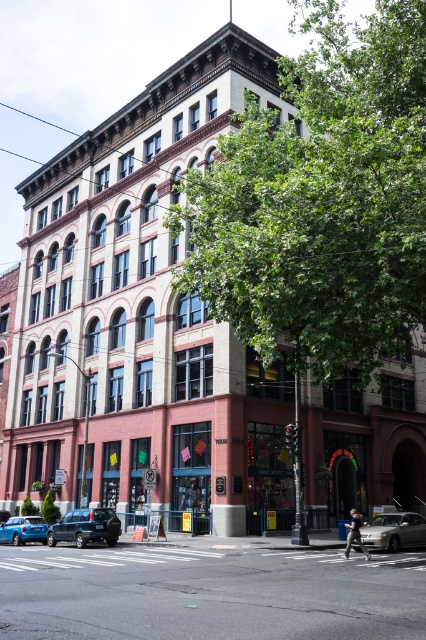
Which of these two, black asphalt at center or silver metallic sedan at lower right, stands shorter?

Standing shorter between the two is silver metallic sedan at lower right.

Where is `black asphalt at center`? black asphalt at center is located at coordinates (207, 593).

Find the location of `black asphalt at center`. black asphalt at center is located at coordinates (207, 593).

Is black matte suv at lower left smaller than silver metallic sedan at lower right?

Actually, black matte suv at lower left might be larger than silver metallic sedan at lower right.

Who is lower down, black matte suv at lower left or silver metallic sedan at lower right?

black matte suv at lower left

You are a GUI agent. You are given a task and a screenshot of the screen. Output one action in this format:
    pyautogui.click(x=<x>, y=<y>)
    Task: Click on the black matte suv at lower left
    This screenshot has height=640, width=426.
    Given the screenshot: What is the action you would take?
    pyautogui.click(x=86, y=525)

Between black matte suv at lower left and metallic blue sedan at lower left, which one has more height?

black matte suv at lower left is taller.

Is black matte suv at lower left wider than metallic blue sedan at lower left?

Indeed, black matte suv at lower left has a greater width compared to metallic blue sedan at lower left.

What do you see at coordinates (86, 525) in the screenshot? I see `black matte suv at lower left` at bounding box center [86, 525].

Image resolution: width=426 pixels, height=640 pixels. Identify the location of black matte suv at lower left. (86, 525).